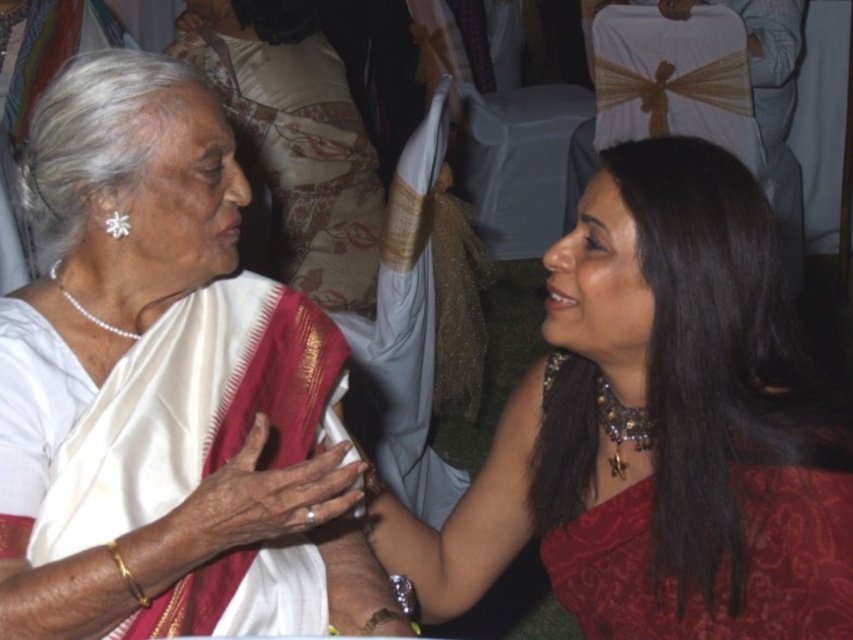
Question: Can you confirm if white silk saree at center is wider than matte red saree at center?

Choices:
 (A) no
 (B) yes

Answer: (A)

Question: Is matte red saree at center positioned in front of white silk saree at upper left?

Choices:
 (A) no
 (B) yes

Answer: (B)

Question: Among these objects, which one is nearest to the camera?

Choices:
 (A) matte red saree at center
 (B) white silk saree at center
 (C) red satin dress at right
 (D) white silk saree at upper left

Answer: (B)

Question: Which is farther from the white silk saree at center?

Choices:
 (A) white silk saree at upper left
 (B) matte red saree at center
 (C) red satin dress at right

Answer: (A)

Question: Is white silk saree at center to the left of matte red saree at center from the viewer's perspective?

Choices:
 (A) yes
 (B) no

Answer: (A)

Question: Based on their relative distances, which object is farther from the white silk saree at upper left?

Choices:
 (A) red satin dress at right
 (B) white silk saree at center

Answer: (A)